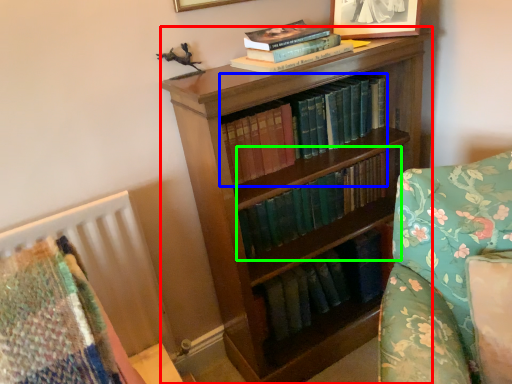
Question: Estimate the real-world distances between objects in this image. Which object is closer to bookcase (highlighted by a red box), book (highlighted by a blue box) or book (highlighted by a green box)?

Choices:
 (A) book
 (B) book

Answer: (B)